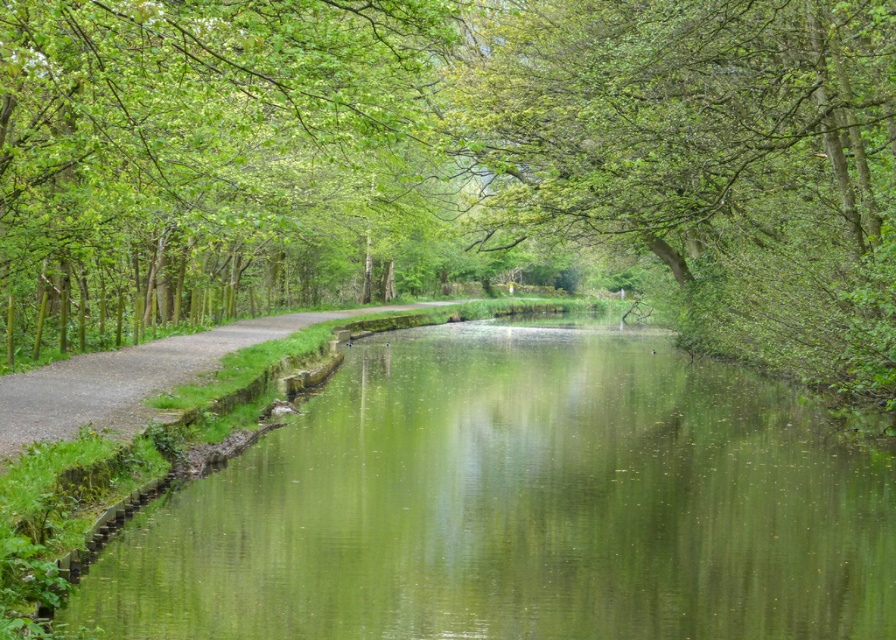
You are standing on the paved path on the left side of the image and want to walk directly towards the green leafy tree at center. In which direction should you head?

You should head towards the center of the image, as the green leafy tree at center is located at point [454,164], which is centrally positioned in the scene.

You are standing on the paved path on the left side of the image and want to walk towards the green leafy tree at center and the green leafy tree at upper left. Which tree will you reach first?

You will reach the green leafy tree at center first because it is closer to you than the green leafy tree at upper left, which is further away.

You are a landscape architect designing a walking path. You want to place a bench between the green leafy tree at center and the green reflective water at center so that it is equidistant from both. Is this possible given their current positions?

The green leafy tree at center and green reflective water at center are 9.31 meters apart. To place a bench equidistant from both, it would need to be placed exactly halfway between them, which is 4.655 meters from each. This is possible as long as there is enough space between them for the bench to be placed centrally.